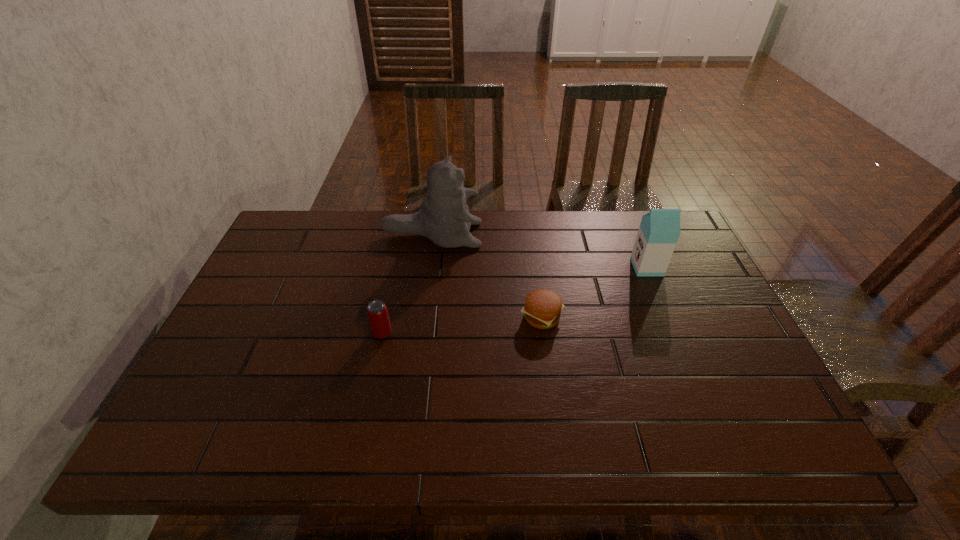
Identify the location of vacant space that satisfies the following two spatial constraints: 1. on the back side of the milk carton; 2. on the left side of the third tallest object. The height and width of the screenshot is (540, 960). (396, 267).

At what (x,y) coordinates should I click in order to perform the action: click on vacant area in the image that satisfies the following two spatial constraints: 1. on the face of the hamburger; 2. on the right side of the tallest object. Please return your answer as a coordinate pair (x, y). The width and height of the screenshot is (960, 540). Looking at the image, I should click on (421, 317).

I want to click on vacant space that satisfies the following two spatial constraints: 1. on the face of the tallest object; 2. on the left side of the hamburger, so click(x=421, y=317).

The image size is (960, 540). I want to click on free space in the image that satisfies the following two spatial constraints: 1. on the face of the tallest object; 2. on the left side of the shortest object, so click(421, 317).